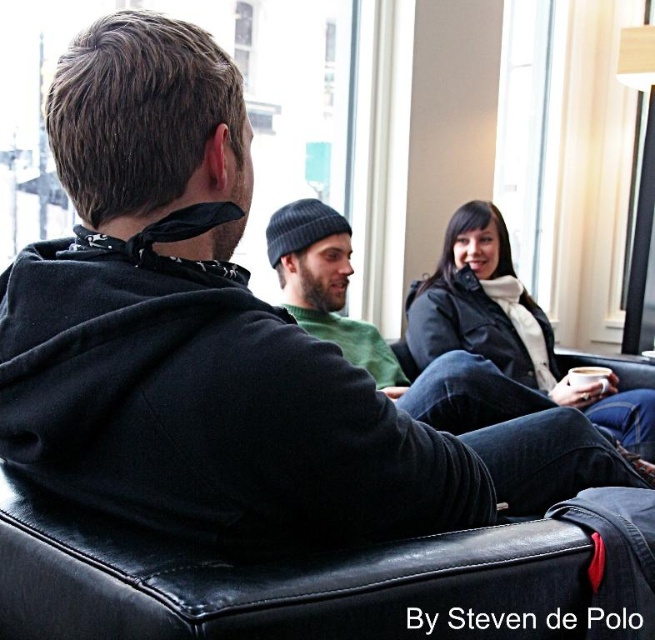
Question: In this image, where is matte black jacket at center located relative to green knit beanie at center?

Choices:
 (A) right
 (B) left

Answer: (A)

Question: Which object is closer to the camera taking this photo?

Choices:
 (A) green knit beanie at center
 (B) matte black jacket at center

Answer: (B)

Question: Is matte black jacket at center smaller than green knit beanie at center?

Choices:
 (A) no
 (B) yes

Answer: (A)

Question: From the image, what is the correct spatial relationship of matte black jacket at center in relation to green knit beanie at center?

Choices:
 (A) right
 (B) left

Answer: (A)

Question: Which of the following is the closest to the observer?

Choices:
 (A) matte black jacket at center
 (B) green knit beanie at center

Answer: (A)